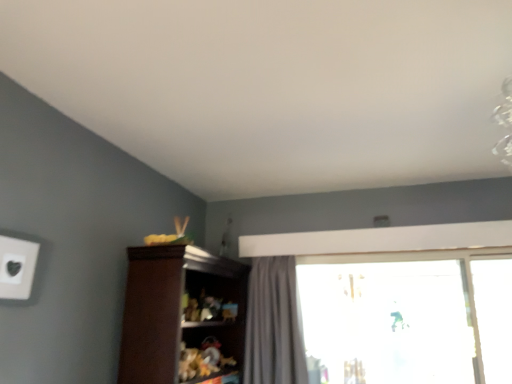
Question: From a real-world perspective, is transparent glass window at center under brown wood cupboard at center?

Choices:
 (A) no
 (B) yes

Answer: (A)

Question: Is the position of transparent glass window at center more distant than that of brown wood cupboard at center?

Choices:
 (A) no
 (B) yes

Answer: (B)

Question: Is transparent glass window at center to the right of brown wood cupboard at center from the viewer's perspective?

Choices:
 (A) no
 (B) yes

Answer: (B)

Question: From a real-world perspective, is transparent glass window at center physically above brown wood cupboard at center?

Choices:
 (A) yes
 (B) no

Answer: (A)

Question: Is transparent glass window at center to the left of brown wood cupboard at center from the viewer's perspective?

Choices:
 (A) yes
 (B) no

Answer: (B)

Question: Visually, is white matte electric outlet at upper left positioned to the left or to the right of transparent glass window at center?

Choices:
 (A) left
 (B) right

Answer: (A)

Question: Do you think white matte electric outlet at upper left is within transparent glass window at center, or outside of it?

Choices:
 (A) inside
 (B) outside

Answer: (B)

Question: In terms of height, does white matte electric outlet at upper left look taller or shorter compared to transparent glass window at center?

Choices:
 (A) tall
 (B) short

Answer: (B)

Question: Relative to transparent glass window at center, is white matte electric outlet at upper left in front or behind?

Choices:
 (A) behind
 (B) front

Answer: (B)

Question: From a real-world perspective, relative to transparent glass window at center, is gray fabric curtain at center vertically above or below?

Choices:
 (A) below
 (B) above

Answer: (A)

Question: In the image, is gray fabric curtain at center on the left side or the right side of transparent glass window at center?

Choices:
 (A) right
 (B) left

Answer: (B)

Question: In terms of height, does gray fabric curtain at center look taller or shorter compared to transparent glass window at center?

Choices:
 (A) tall
 (B) short

Answer: (B)

Question: Does point (274, 327) appear closer or farther from the camera than point (495, 251)?

Choices:
 (A) closer
 (B) farther

Answer: (A)

Question: Considering their positions, is white matte electric outlet at upper left located in front of or behind brown wood cupboard at center?

Choices:
 (A) front
 (B) behind

Answer: (A)

Question: Is white matte electric outlet at upper left wider or thinner than brown wood cupboard at center?

Choices:
 (A) wide
 (B) thin

Answer: (B)